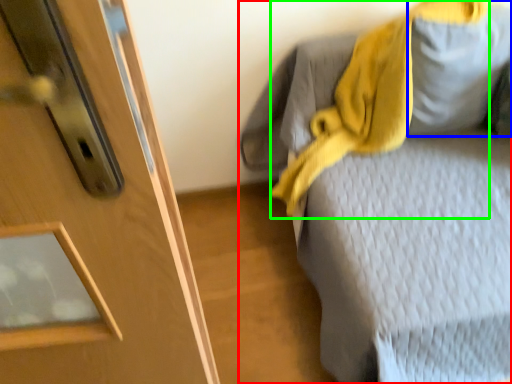
Question: Which object is positioned closest to furniture (highlighted by a red box)? Select from gray (highlighted by a blue box) and scarf (highlighted by a green box).

Choices:
 (A) gray
 (B) scarf

Answer: (B)